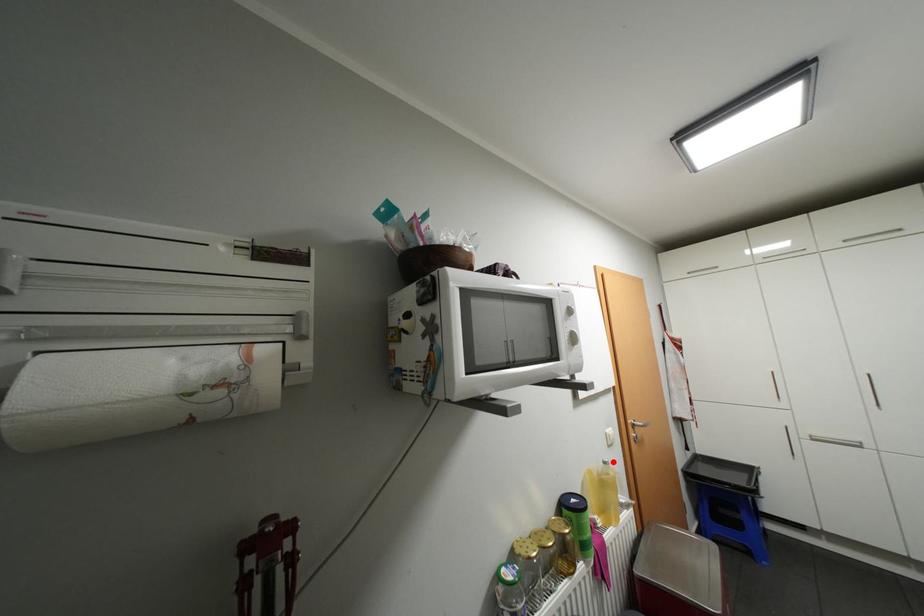
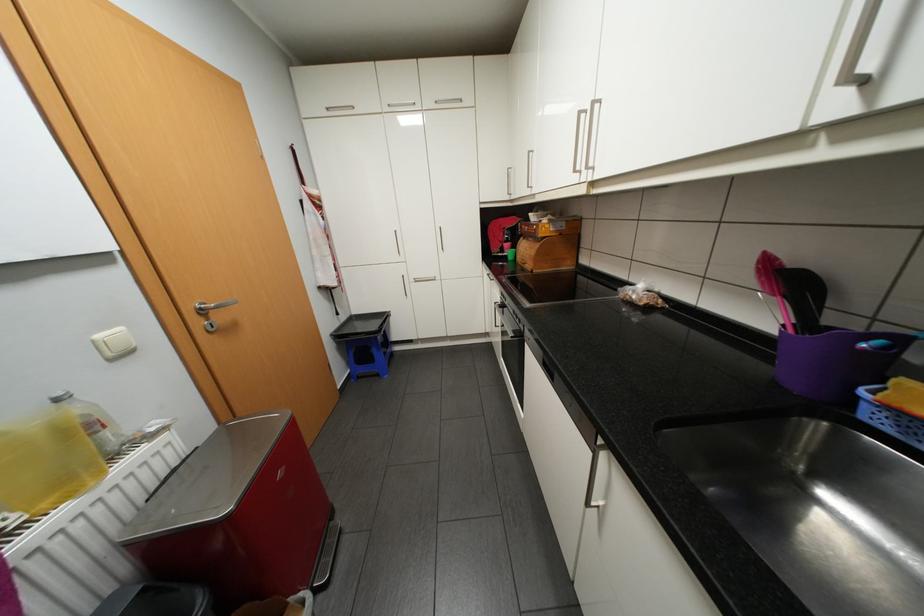
Locate, in the second image, the point that corresponds to the highlighted location in the first image.

(65, 399)